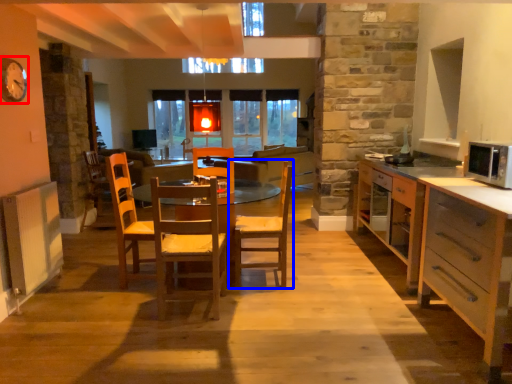
Question: Among these objects, which one is nearest to the camera, clock (highlighted by a red box) or chair (highlighted by a blue box)?

Choices:
 (A) clock
 (B) chair

Answer: (A)